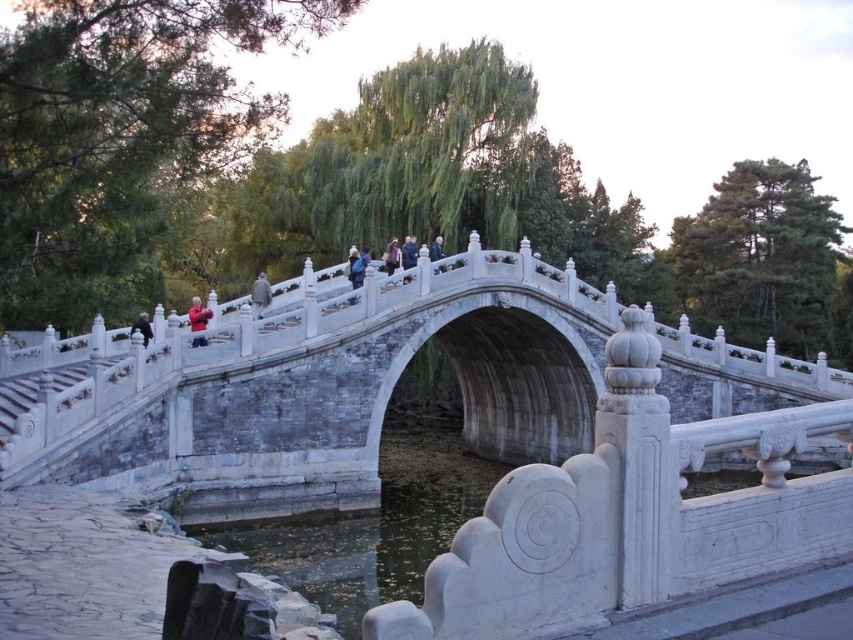
Between clear water at bridge center and dark blue fabric jacket at center, which one is positioned higher?

dark blue fabric jacket at center

Measure the distance from clear water at bridge center to dark blue fabric jacket at center.

clear water at bridge center is 20.77 meters from dark blue fabric jacket at center.

The width and height of the screenshot is (853, 640). Describe the element at coordinates (370, 529) in the screenshot. I see `clear water at bridge center` at that location.

Where is `clear water at bridge center`? clear water at bridge center is located at coordinates (370, 529).

Between point (254, 310) and point (392, 273), which one is positioned behind?

Point (392, 273)

Measure the distance between point (257, 282) and camera.

A distance of 244.63 feet exists between point (257, 282) and camera.

Where is `gray stone statue at center`? This screenshot has height=640, width=853. gray stone statue at center is located at coordinates (260, 296).

Between point (409, 241) and point (439, 236), which one is positioned in front?

Point (409, 241) is in front.

Is matte gray stone person at center positioned before dark blue fabric jacket at center?

Yes.

Does point (410, 241) lie in front of point (440, 268)?

No, (410, 241) is further to viewer.

The width and height of the screenshot is (853, 640). I want to click on matte gray stone person at center, so click(x=409, y=252).